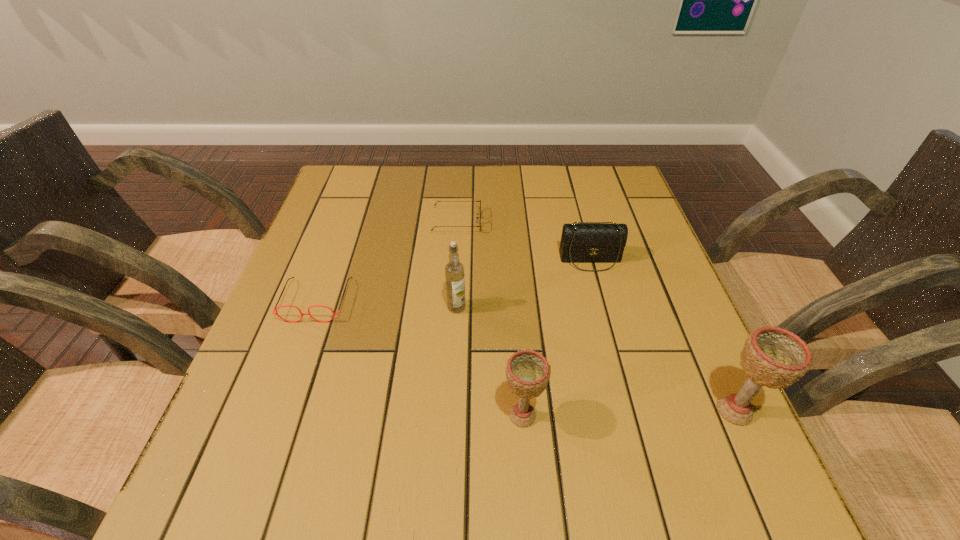
The image size is (960, 540). What are the coordinates of `clutch bag at the right edge` in the screenshot? It's located at (580, 243).

The height and width of the screenshot is (540, 960). Identify the location of object at the near right corner. (773, 357).

In the image, there is a desktop. Where is `free space at the far edge`? free space at the far edge is located at coordinates (481, 167).

Identify the location of vacant area at the near edge of the desktop. The height and width of the screenshot is (540, 960). (482, 425).

Where is `free space at the left edge of the desktop`? The image size is (960, 540). free space at the left edge of the desktop is located at coordinates (350, 235).

Find the location of a particular element. Image resolution: width=960 pixels, height=540 pixels. vacant space at the right edge is located at coordinates (650, 338).

Locate an element on the screen. vacant space at the far left corner of the desktop is located at coordinates (339, 209).

At what (x,y) coordinates should I click in order to perform the action: click on free space between the shortest object and the clutch bag. Please return your answer as a coordinate pair (x, y). Looking at the image, I should click on (523, 241).

I want to click on vacant area that lies between the third shortest object and the vodka, so (x=523, y=284).

The image size is (960, 540). In order to click on unoccupied position between the sunglasses and the fourth object from left to right in this screenshot , I will do `click(490, 319)`.